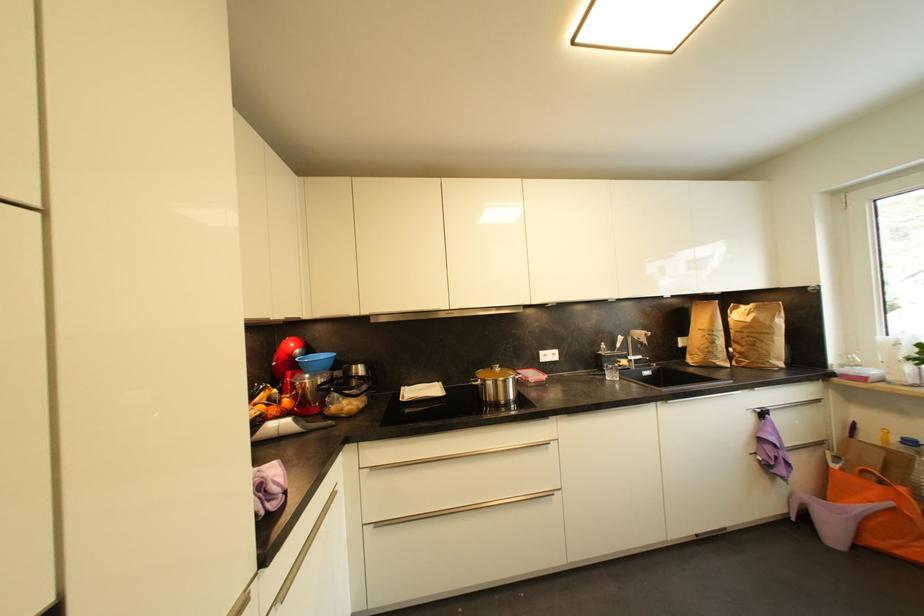
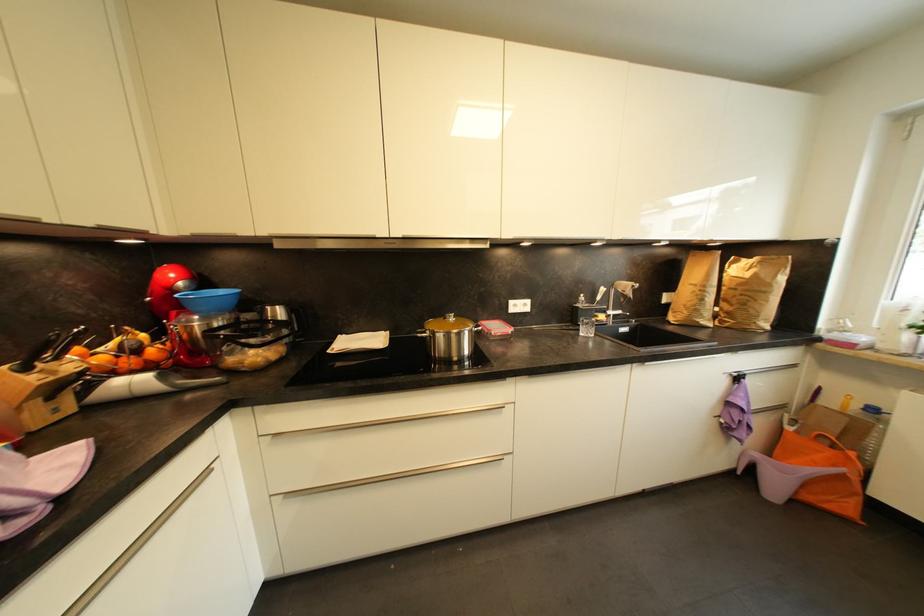
The images are taken continuously from a first-person perspective. In which direction are you moving?

The cameraman walked toward right, forward.